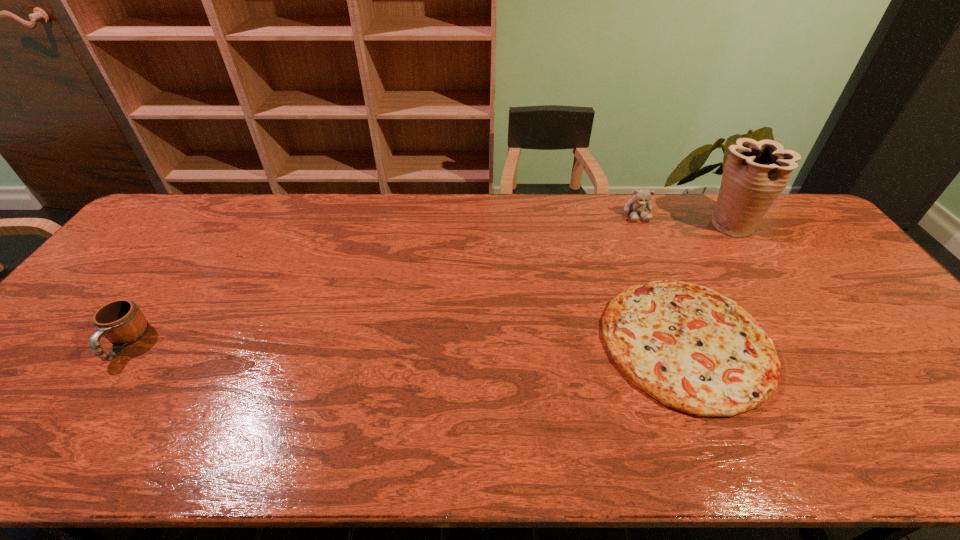
At what (x,y) coordinates should I click in order to perform the action: click on free space that satisfies the following two spatial constraints: 1. on the face of the tallest object; 2. on the right side of the second tallest object. Please return your answer as a coordinate pair (x, y). The image size is (960, 540). Looking at the image, I should click on (x=640, y=224).